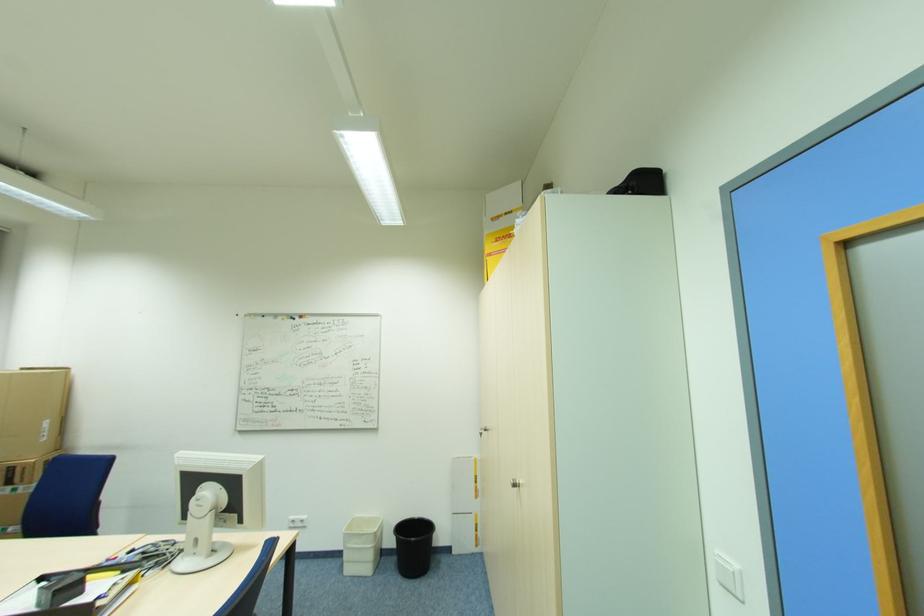
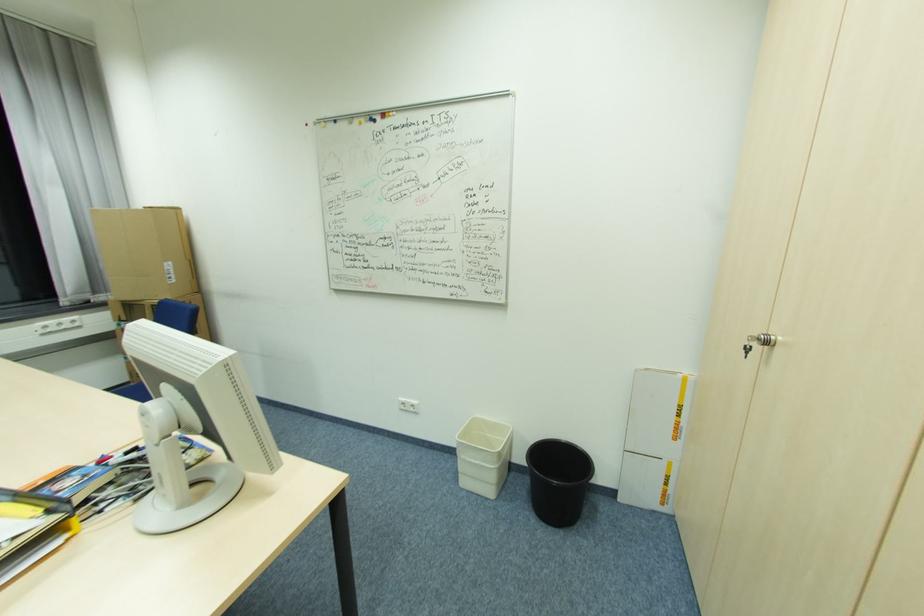
Find the pixel in the second image that matches (x=346, y=565) in the first image.

(463, 475)